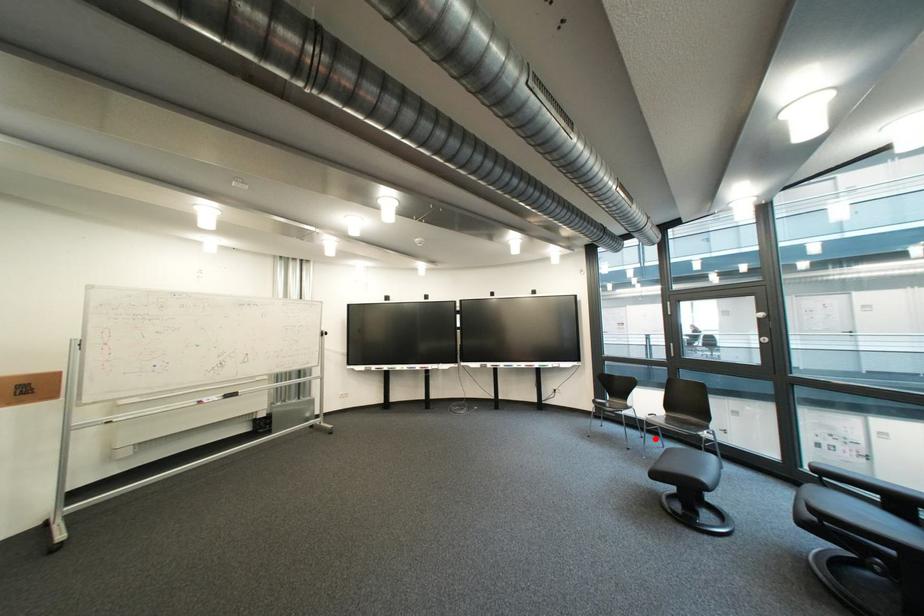
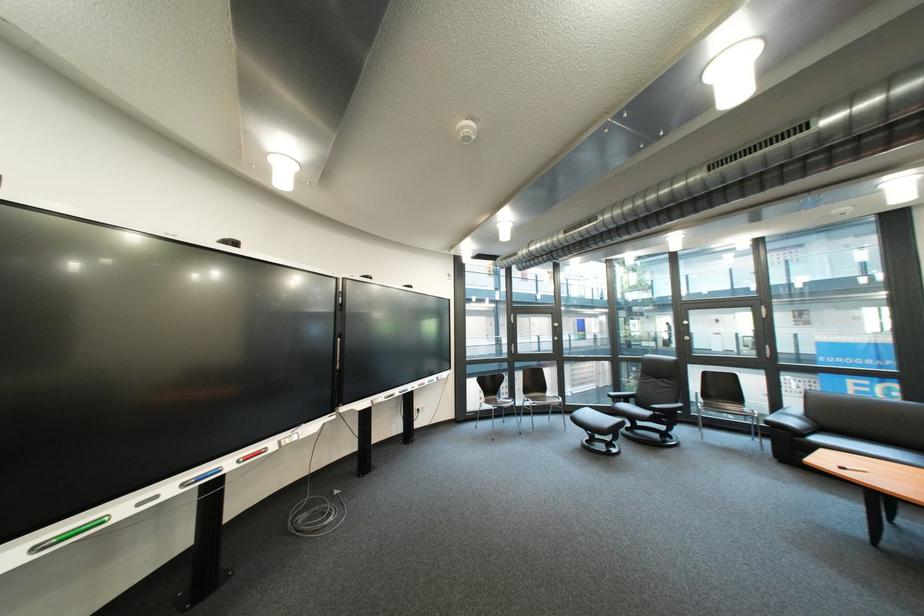
Where in the second image is the point corresponding to the highlighted location from the first image?

(517, 424)